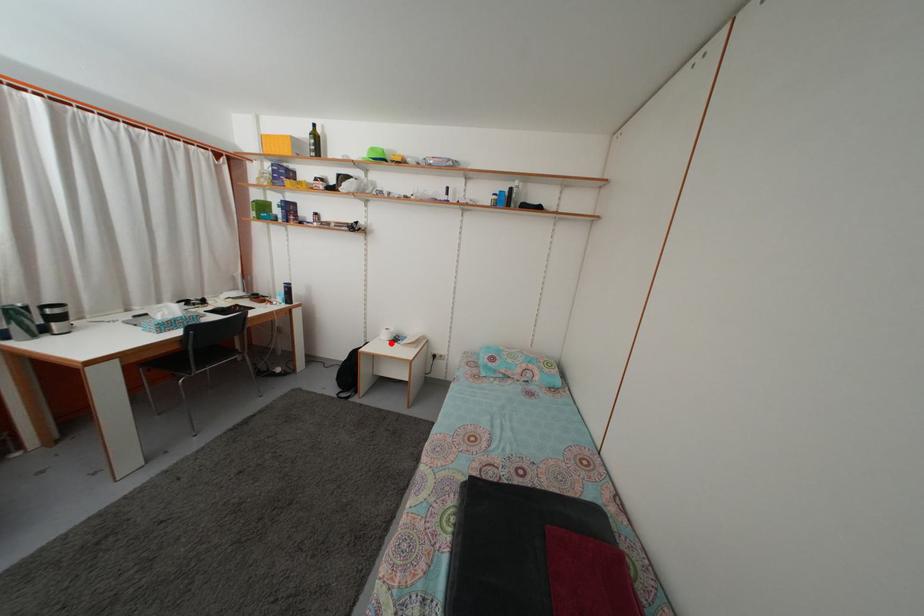
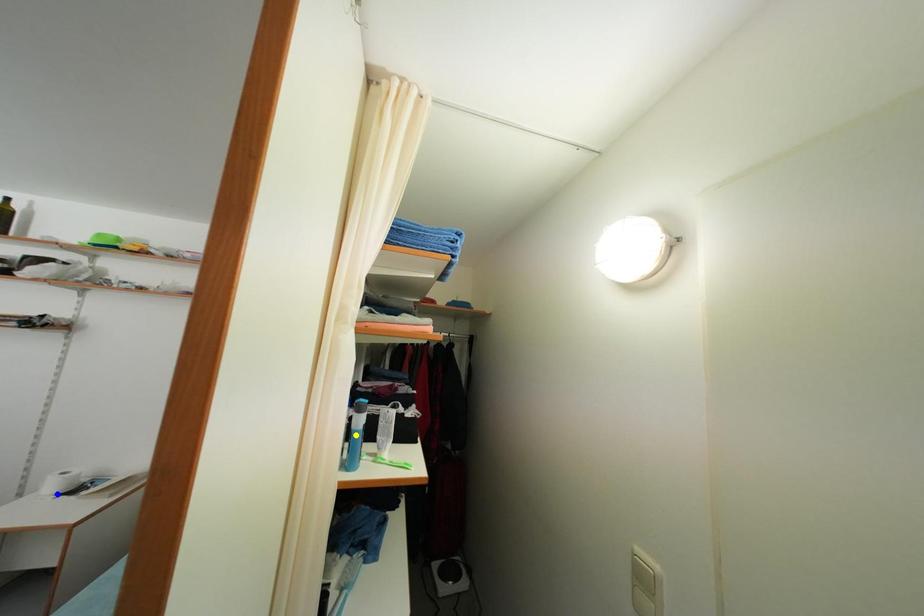
Question: I am providing you with two images of the same scene from different viewpoints. A red point is marked on the first image. You are given multiple points on the second image. Which spot in image 2 lines up with the point in image 1?

Choices:
 (A) green point
 (B) blue point
 (C) yellow point

Answer: (B)